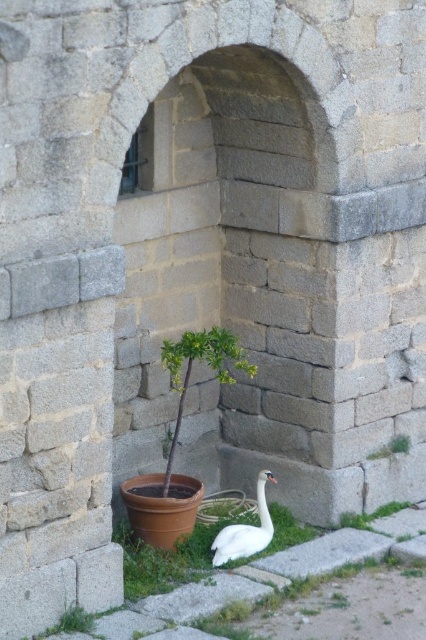
You are standing in front of the stone wall with an arched opening. You notice two points marked on the ground. The first point is at coordinate point (230, 560) and the second is at point (397, 436). Which point is closer to you?

Point (230, 560) is in front of point (397, 436), so it is closer to you.

You are a gardener who needs to water both the green leafy plant at center and the white glossy swan at lower center. Which object requires more water based on their sizes?

The green leafy plant at center requires more water because it has a larger size compared to the white glossy swan at lower center.

Consider the image. You are a visitor standing in front of the stone wall with an arched opening. You see the white glossy swan at lower center and the green leafy plant at lower right. Which object is positioned lower in the scene?

The white glossy swan at lower center is located below the green leafy plant at lower right, so it is positioned lower in the scene.